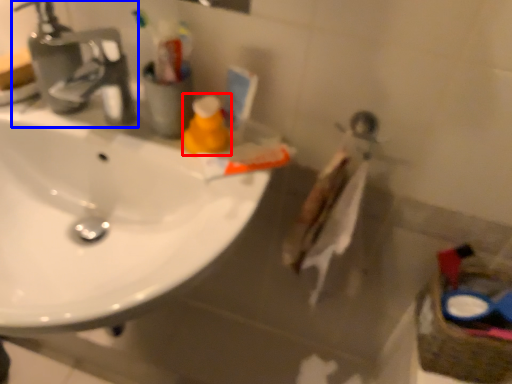
Question: Among these objects, which one is nearest to the camera, cleaning product (highlighted by a red box) or tap (highlighted by a blue box)?

Choices:
 (A) cleaning product
 (B) tap

Answer: (B)